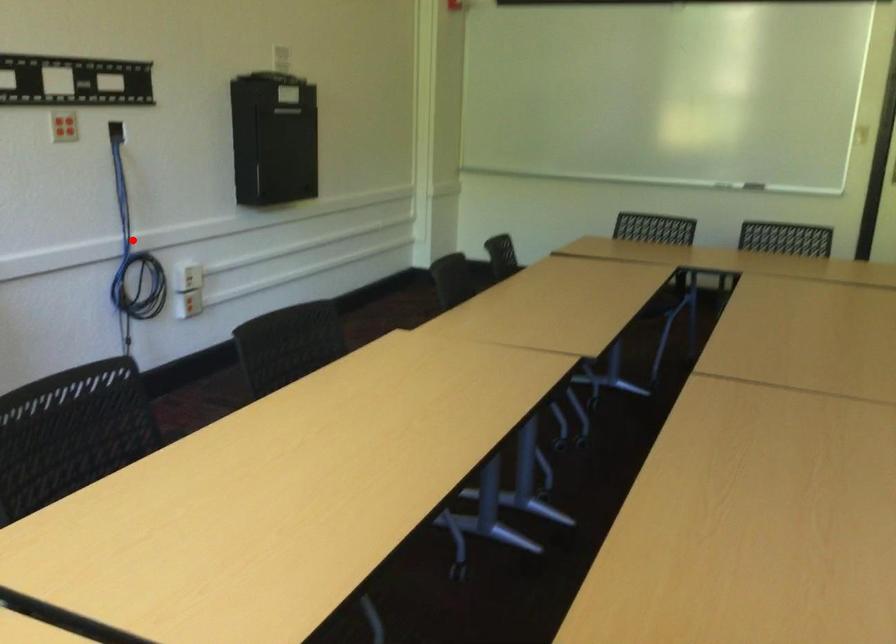
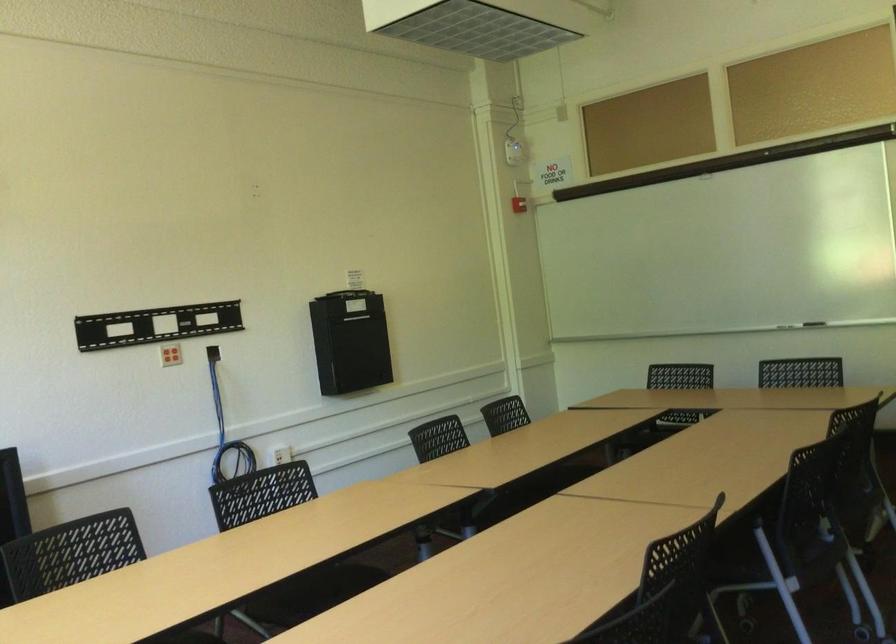
Where in the second image is the point corresponding to the highlighted location from the first image?

(226, 431)